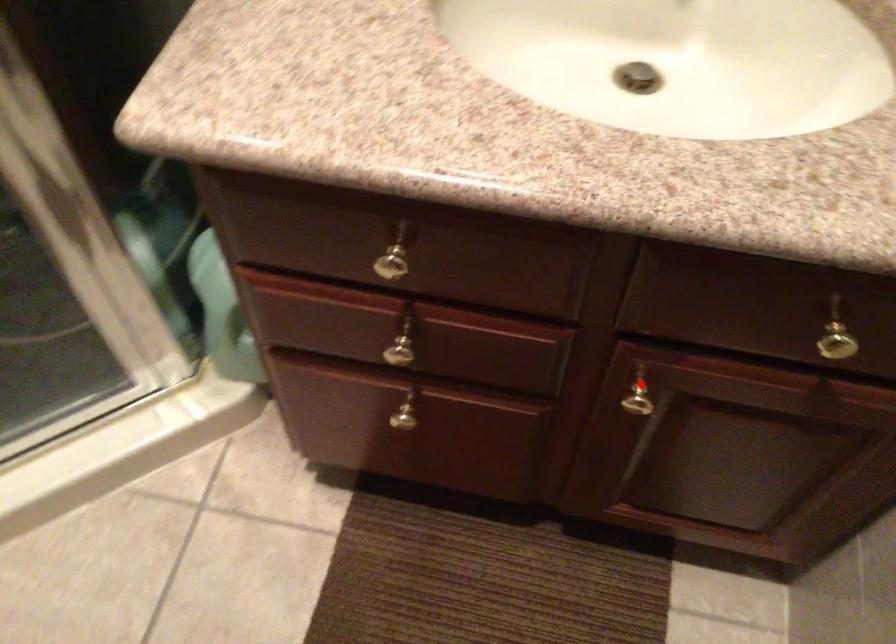
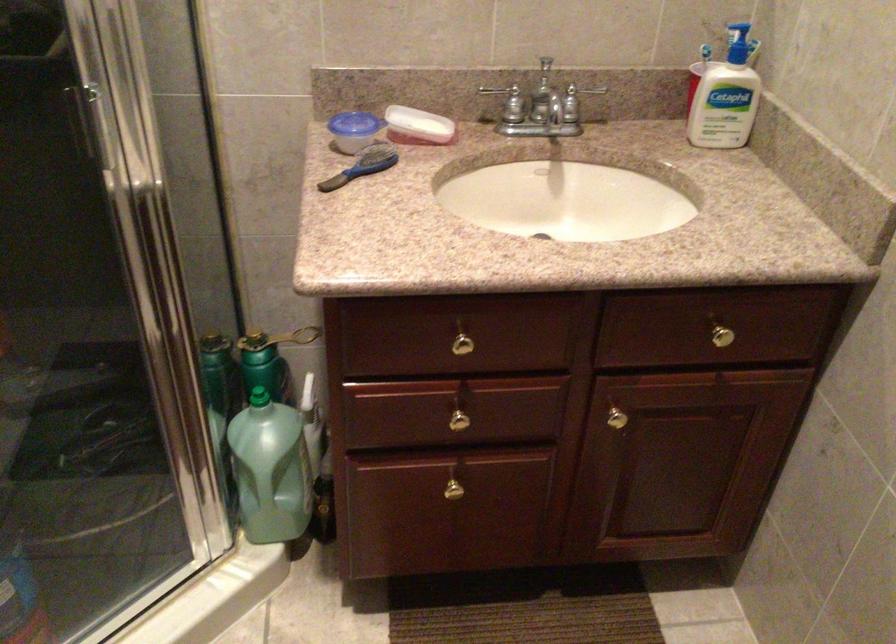
Where in the second image is the point corresponding to the highlighted location from the first image?

(612, 411)